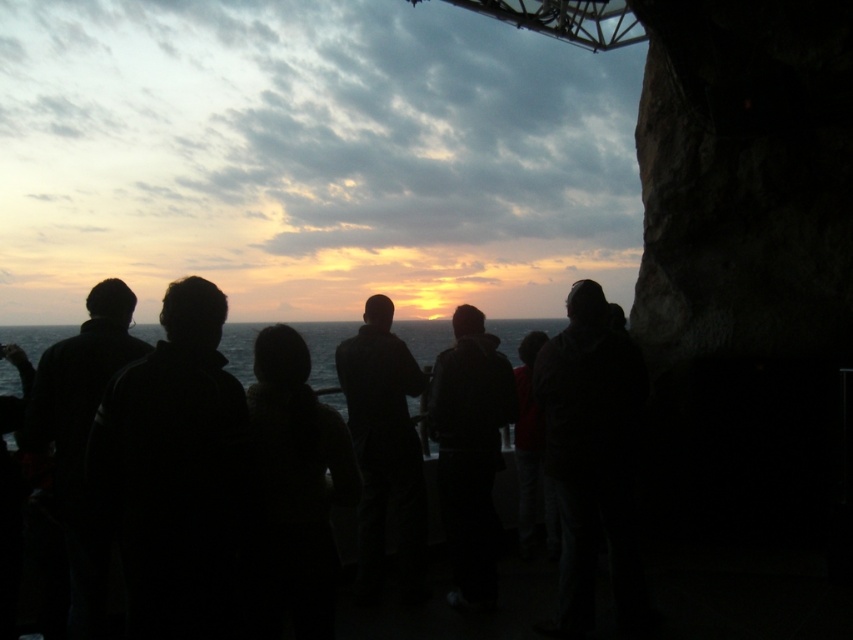
Can you confirm if black matte people at center is positioned above olive green water at center?

Correct, black matte people at center is located above olive green water at center.

Which is behind, point (492, 426) or point (44, 333)?

The point (44, 333) is more distant.

The image size is (853, 640). Identify the location of black matte people at center. (86, 433).